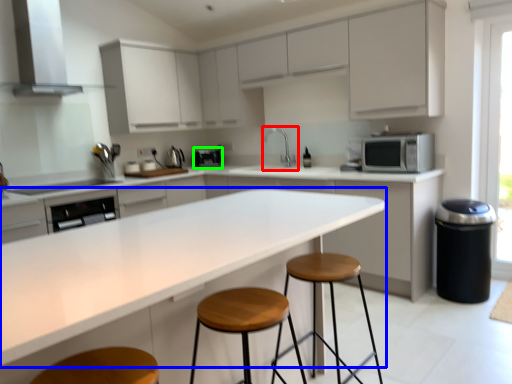
Question: Considering the real-world distances, which object is closest to sink (highlighted by a red box)? countertop (highlighted by a blue box) or appliance (highlighted by a green box).

Choices:
 (A) countertop
 (B) appliance

Answer: (B)